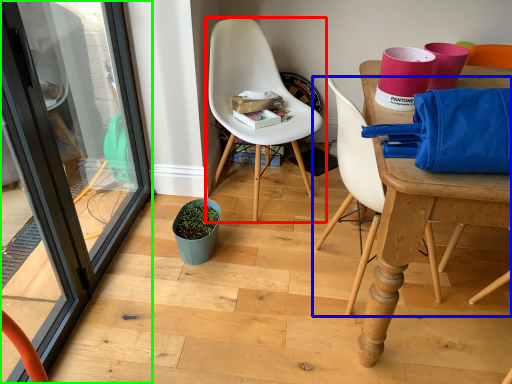
Question: Considering the real-world distances, which object is farthest from chair (highlighted by a red box)? chair (highlighted by a blue box) or screen door (highlighted by a green box)?

Choices:
 (A) chair
 (B) screen door

Answer: (B)